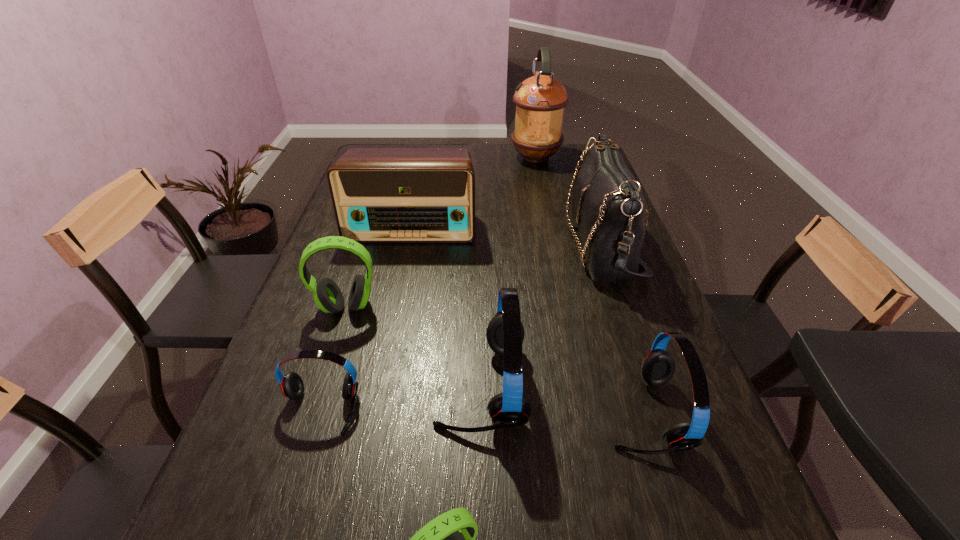
You are a GUI agent. You are given a task and a screenshot of the screen. Output one action in this format:
    pyautogui.click(x=<x>, y=<y>)
    Task: Click on the headset that is the closest to the handbag
    
    Given the screenshot: What is the action you would take?
    pyautogui.click(x=505, y=333)

Point out which red headset is positioned as the nearest to the biggest red headset. Please provide its 2D coordinates. Your answer should be formatted as a tuple, i.e. [(x, y)], where the tuple contains the x and y coordinates of a point satisfying the conditions above.

[(292, 386)]

Locate which red headset is the second closest to the radio receiver. Please provide its 2D coordinates. Your answer should be formatted as a tuple, i.e. [(x, y)], where the tuple contains the x and y coordinates of a point satisfying the conditions above.

[(292, 386)]